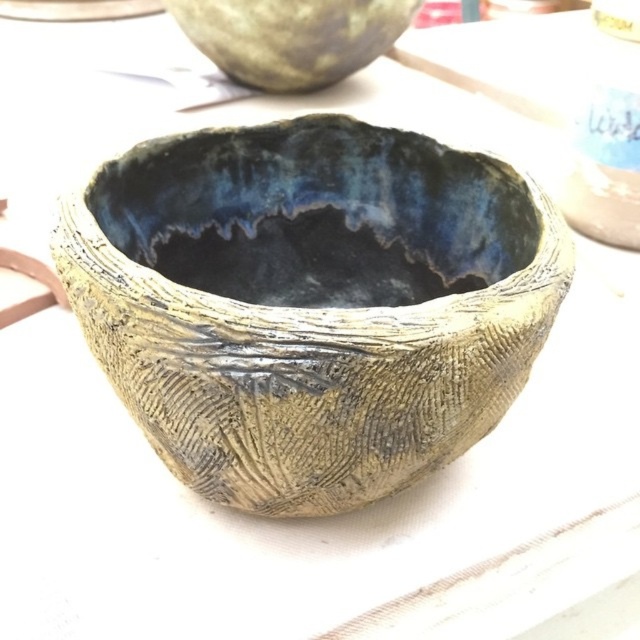
Is textured clay bowl at center shorter than matte ceramic bowl at upper center?

No, textured clay bowl at center is not shorter than matte ceramic bowl at upper center.

Which is behind, point (160, 150) or point (369, 12)?

Positioned behind is point (369, 12).

Who is more forward, (278, 348) or (230, 28)?

Point (278, 348) is in front.

This screenshot has width=640, height=640. What are the coordinates of `textured clay bowl at center` in the screenshot? It's located at (312, 308).